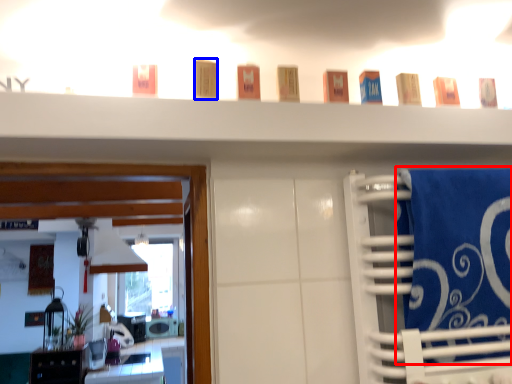
Question: Which point is further to the camera, bath towel (highlighted by a red box) or toiletry (highlighted by a blue box)?

Choices:
 (A) bath towel
 (B) toiletry

Answer: (B)